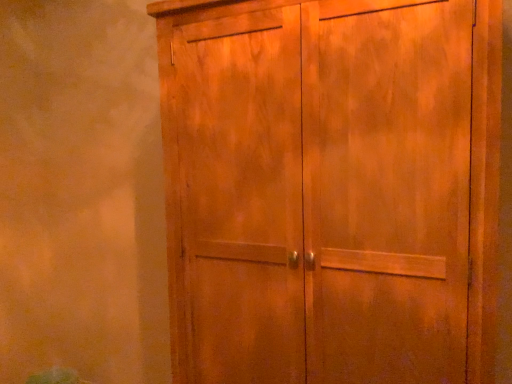
Locate an element on the screen. wooden cupboard at center is located at coordinates (364, 190).

Measure the distance between point [175,351] and camera.

The depth of point [175,351] is 4.70 feet.

What do you see at coordinates (364, 190) in the screenshot? I see `wooden cupboard at center` at bounding box center [364, 190].

You are a GUI agent. You are given a task and a screenshot of the screen. Output one action in this format:
    pyautogui.click(x=<x>, y=<y>)
    Task: Click on the wooden cupboard at center
    The width and height of the screenshot is (512, 384).
    Given the screenshot: What is the action you would take?
    pyautogui.click(x=364, y=190)